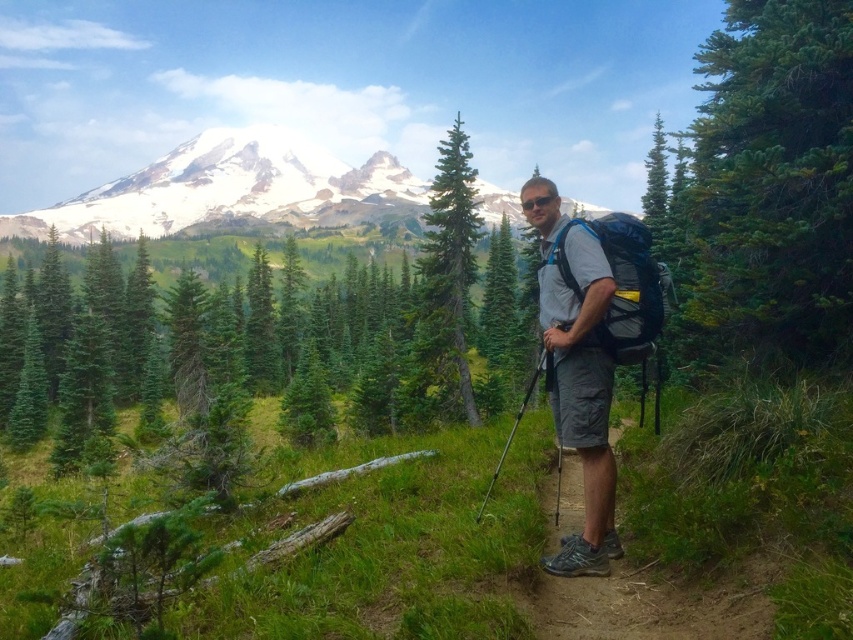
Is green textured pine tree at center-right thinner than green textured pine tree at center?

In fact, green textured pine tree at center-right might be wider than green textured pine tree at center.

Between green textured pine tree at center-right and green textured pine tree at center, which one has less height?

green textured pine tree at center is shorter.

Between point (793, 112) and point (461, 132), which one is positioned behind?

The point (461, 132) is behind.

Identify the location of green textured pine tree at center-right. The height and width of the screenshot is (640, 853). (770, 186).

Is green textured pine tree at center-right in front of matte gray backpack at center-right?

No, green textured pine tree at center-right is behind matte gray backpack at center-right.

Between point (769, 35) and point (656, 320), which one is positioned behind?

Point (769, 35)

Who is more forward, (791, 113) or (608, 241)?

Point (608, 241) is more forward.

Identify the location of green textured pine tree at center-right. This screenshot has width=853, height=640. (770, 186).

Does snowy white mountain at upper center have a lesser width compared to matte gray backpack at center-right?

In fact, snowy white mountain at upper center might be wider than matte gray backpack at center-right.

Which is behind, point (283, 163) or point (619, 356)?

The point (283, 163) is behind.

The width and height of the screenshot is (853, 640). What are the coordinates of `snowy white mountain at upper center` in the screenshot? It's located at (231, 189).

Locate an element on the screen. The height and width of the screenshot is (640, 853). snowy white mountain at upper center is located at coordinates (231, 189).